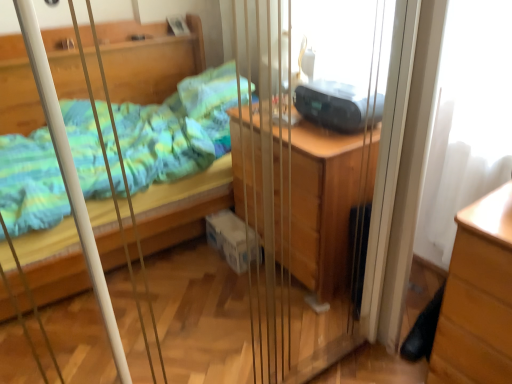
Question: Should I look upward or downward to see light brown wood chest of drawers at lower right?

Choices:
 (A) up
 (B) down

Answer: (B)

Question: Is light brown wood chest of drawers at lower right oriented away from black plastic radio at upper right?

Choices:
 (A) yes
 (B) no

Answer: (B)

Question: Does light brown wood chest of drawers at lower right come behind black plastic radio at upper right?

Choices:
 (A) yes
 (B) no

Answer: (B)

Question: Is light brown wood chest of drawers at lower right in contact with black plastic radio at upper right?

Choices:
 (A) yes
 (B) no

Answer: (B)

Question: Is light brown wood chest of drawers at lower right not close to black plastic radio at upper right?

Choices:
 (A) no
 (B) yes

Answer: (A)

Question: From a real-world perspective, does light brown wood chest of drawers at lower right sit lower than black plastic radio at upper right?

Choices:
 (A) no
 (B) yes

Answer: (B)

Question: Considering the relative positions of light brown wood chest of drawers at lower right and black plastic radio at upper right in the image provided, is light brown wood chest of drawers at lower right to the right of black plastic radio at upper right from the viewer's perspective?

Choices:
 (A) yes
 (B) no

Answer: (A)

Question: Could you tell me if black plastic radio at upper right is turned towards light brown wood chest of drawers at lower right?

Choices:
 (A) yes
 (B) no

Answer: (B)

Question: Considering the relative sizes of black plastic radio at upper right and light brown wood chest of drawers at lower right in the image provided, is black plastic radio at upper right bigger than light brown wood chest of drawers at lower right?

Choices:
 (A) yes
 (B) no

Answer: (B)

Question: Is the position of black plastic radio at upper right more distant than that of light brown wood chest of drawers at lower right?

Choices:
 (A) no
 (B) yes

Answer: (B)

Question: Is black plastic radio at upper right in front of light brown wood chest of drawers at lower right?

Choices:
 (A) yes
 (B) no

Answer: (B)

Question: Can you confirm if black plastic radio at upper right is thinner than light brown wood chest of drawers at lower right?

Choices:
 (A) no
 (B) yes

Answer: (B)

Question: Considering the relative positions of black plastic radio at upper right and light brown wood chest of drawers at lower right in the image provided, is black plastic radio at upper right to the left of light brown wood chest of drawers at lower right from the viewer's perspective?

Choices:
 (A) no
 (B) yes

Answer: (B)

Question: Is light brown wood chest of drawers at lower right situated inside black plastic radio at upper right or outside?

Choices:
 (A) outside
 (B) inside

Answer: (A)